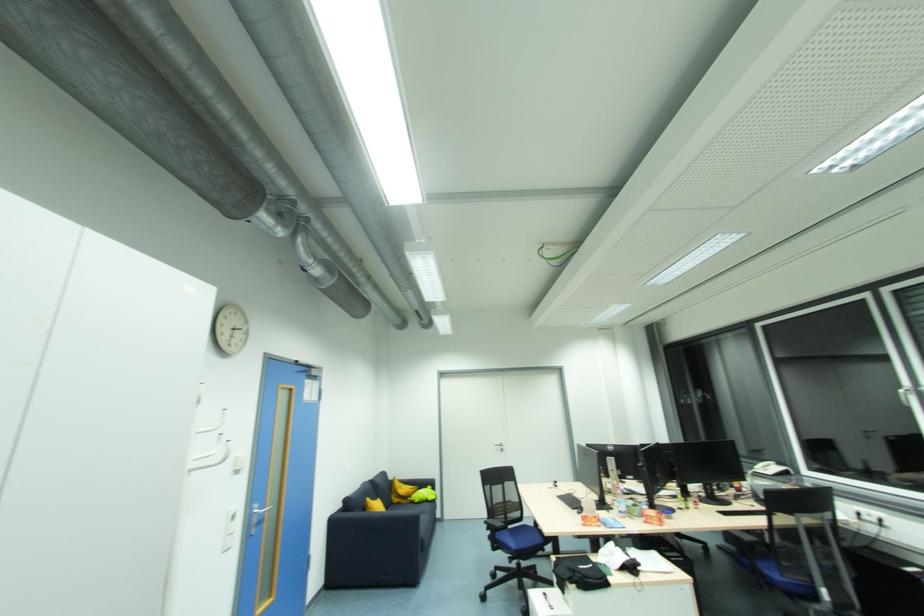
Describe the element at coordinates (418, 512) in the screenshot. This screenshot has height=616, width=924. I see `the blue sofa seat` at that location.